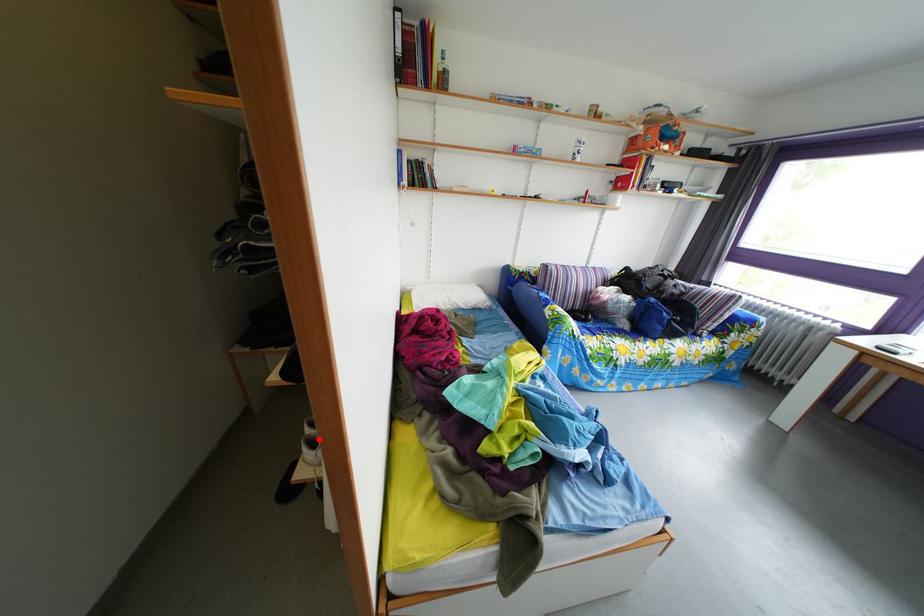
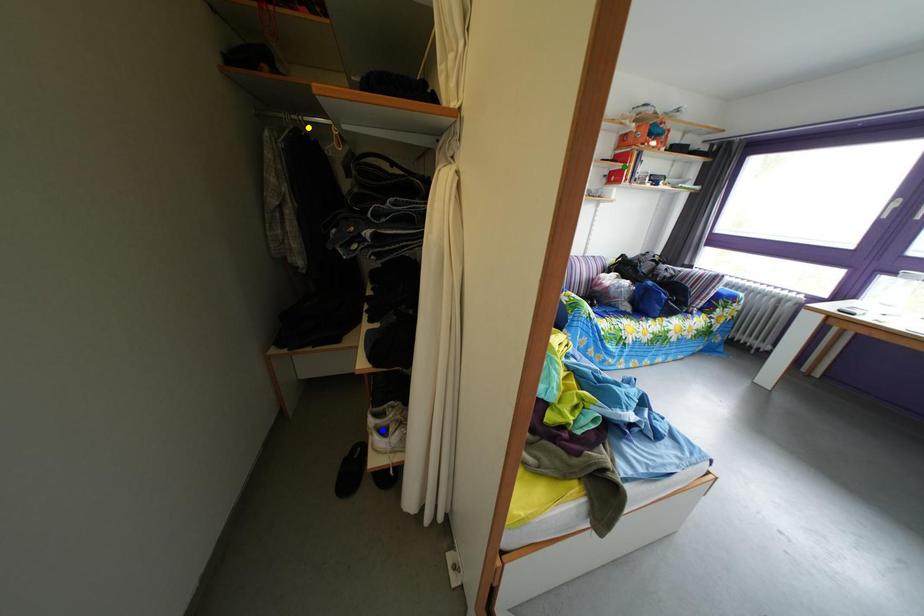
Question: I am providing you with two images of the same scene from different viewpoints. A red point is marked on the first image. You are given multiple points on the second image. Which mark in image 2 goes with the point in image 1?

Choices:
 (A) green point
 (B) yellow point
 (C) blue point

Answer: (C)